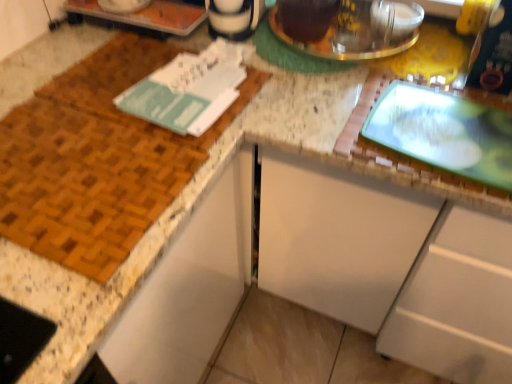
Question: Looking at their shapes, would you say teal paper journal at upper left is wider or thinner than white matte cabinet at center?

Choices:
 (A) wide
 (B) thin

Answer: (B)

Question: Would you say teal paper journal at upper left is to the left or to the right of white matte cabinet at center in the picture?

Choices:
 (A) left
 (B) right

Answer: (A)

Question: Which is farther from the shiny metallic kettle at upper center?

Choices:
 (A) white matte cabinet at center
 (B) teal paper journal at upper left

Answer: (A)

Question: Which object is positioned farthest from the teal paper journal at upper left?

Choices:
 (A) shiny metallic kettle at upper center
 (B) white matte cabinet at center

Answer: (B)